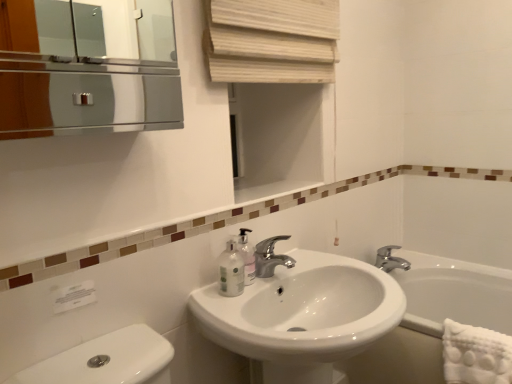
Question: Is silver metallic faucet at center, the 2th tap when ordered from front to back, shorter than white glossy sink at center?

Choices:
 (A) no
 (B) yes

Answer: (B)

Question: Can you confirm if silver metallic faucet at center, positioned as the 1th tap in right-to-left order, is bigger than white glossy sink at center?

Choices:
 (A) yes
 (B) no

Answer: (B)

Question: Does silver metallic faucet at center, the 2th tap when ordered from front to back, turn towards white glossy sink at center?

Choices:
 (A) no
 (B) yes

Answer: (A)

Question: Is silver metallic faucet at center, the 2th tap when ordered from front to back, further to camera compared to white glossy sink at center?

Choices:
 (A) yes
 (B) no

Answer: (A)

Question: Is silver metallic faucet at center, the 2th tap when ordered from front to back, not close to white glossy sink at center?

Choices:
 (A) no
 (B) yes

Answer: (A)

Question: Is silver metallic faucet at center, the 1th tap in the back-to-front sequence, not within white glossy sink at center?

Choices:
 (A) no
 (B) yes

Answer: (B)

Question: Is translucent plastic mouthwash at lower center surrounding polished chrome faucet at center, the 1th tap from the front?

Choices:
 (A) yes
 (B) no

Answer: (B)

Question: From the image's perspective, is translucent plastic mouthwash at lower center below polished chrome faucet at center, the second tap positioned from the right?

Choices:
 (A) no
 (B) yes

Answer: (B)

Question: Considering the relative sizes of translucent plastic mouthwash at lower center and polished chrome faucet at center, the first tap positioned from the left, in the image provided, is translucent plastic mouthwash at lower center wider than polished chrome faucet at center, the first tap positioned from the left,?

Choices:
 (A) no
 (B) yes

Answer: (A)

Question: Can you confirm if translucent plastic mouthwash at lower center is smaller than polished chrome faucet at center, the 1th tap from the front?

Choices:
 (A) no
 (B) yes

Answer: (B)

Question: From a real-world perspective, is translucent plastic mouthwash at lower center below polished chrome faucet at center, the first tap positioned from the left?

Choices:
 (A) yes
 (B) no

Answer: (B)

Question: Is translucent plastic mouthwash at lower center bigger than polished chrome faucet at center, the second tap positioned from the right?

Choices:
 (A) yes
 (B) no

Answer: (B)

Question: Is translucent plastic soap dispenser at sink wider than polished chrome faucet at center, the first tap positioned from the left?

Choices:
 (A) yes
 (B) no

Answer: (B)